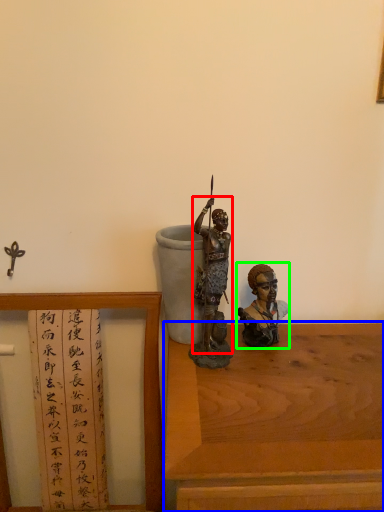
Question: Which is nearer to the person (highlighted by a red box)? table (highlighted by a blue box) or person (highlighted by a green box).

Choices:
 (A) table
 (B) person

Answer: (B)